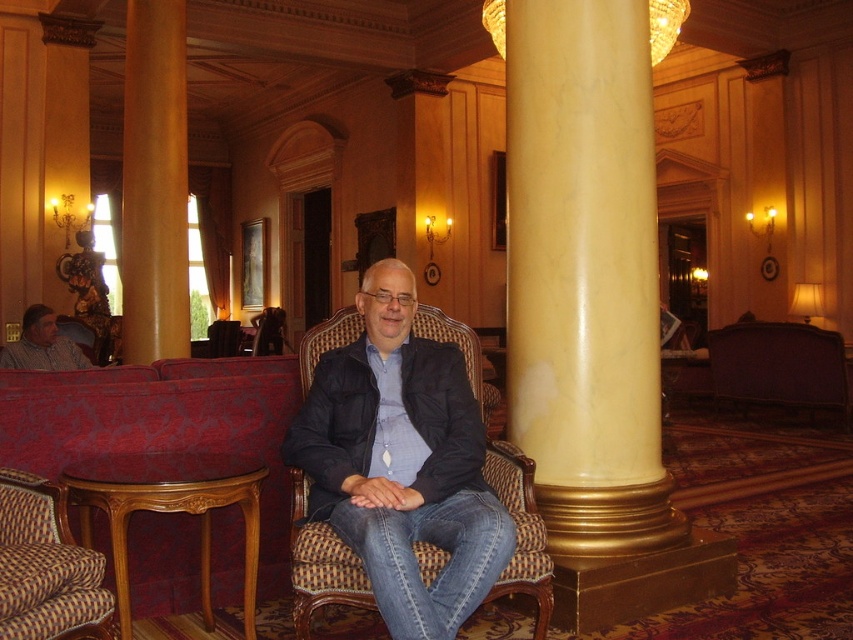
Question: Is wooden polished stool at lower left wider than purple velvet couch at right?

Choices:
 (A) yes
 (B) no

Answer: (B)

Question: Can you confirm if matte black jacket at center is wider than purple velvet couch at right?

Choices:
 (A) yes
 (B) no

Answer: (B)

Question: Does matte black jacket at center lie behind velvet red couch at lower left?

Choices:
 (A) no
 (B) yes

Answer: (A)

Question: Which point is closer to the camera?

Choices:
 (A) (189, 481)
 (B) (451, 570)
 (C) (635, 452)
 (D) (128, 305)

Answer: (B)

Question: Which point is farther to the camera?

Choices:
 (A) yellow marble column at left
 (B) velvet red couch at lower left
 (C) plaid fabric armchair at lower left
 (D) yellow marble column at center

Answer: (A)

Question: Which object is closer to the camera taking this photo?

Choices:
 (A) yellow marble column at center
 (B) purple velvet couch at right
 (C) wooden polished stool at lower left

Answer: (C)